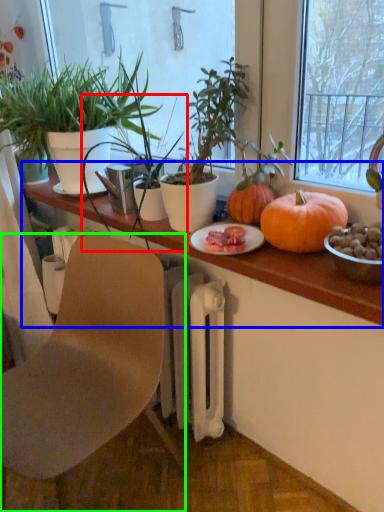
Question: Which object is positioned closest to houseplant (highlighted by a red box)? Select from table (highlighted by a blue box) and chair (highlighted by a green box).

Choices:
 (A) table
 (B) chair

Answer: (A)